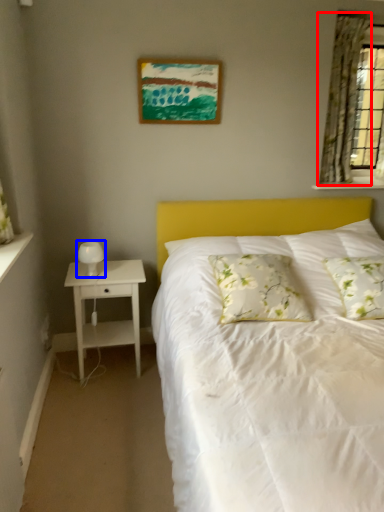
Question: Which object is further to the camera taking this photo, curtain (highlighted by a red box) or table lamp (highlighted by a blue box)?

Choices:
 (A) curtain
 (B) table lamp

Answer: (A)